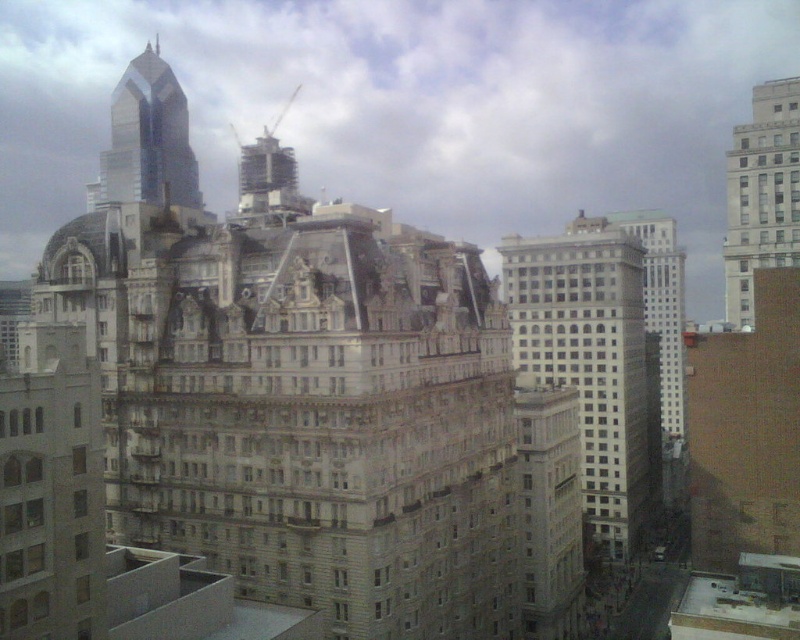
You are a city planner analyzing a map of the city. You notice a point marked at coordinates (x=594, y=365). Based on the scene description, which building does this point belong to?

The point at coordinates (x=594, y=365) is on the gray stone building at center.

You are standing at the viewpoint where you can see both points labeled as point [614,433] and point [748,144] in the cityscape. Which point is closer to you?

Point [748,144] is closer to you because point [614,433] is behind it.

You are standing in the city square and want to take a photo of the gray stone building at center and the white stone building at upper right. Which building will appear larger in your photo?

The gray stone building at center will appear larger in your photo because it is closer to you than the white stone building at upper right.